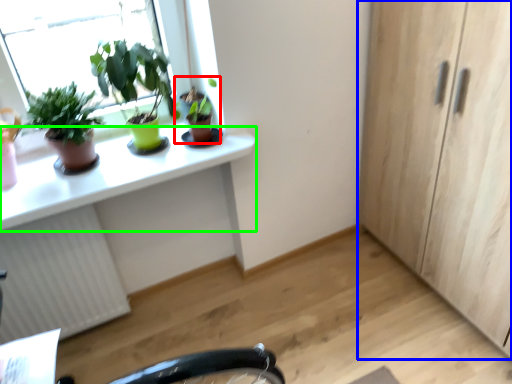
Question: Estimate the real-world distances between objects in this image. Which object is closer to houseplant (highlighted by a red box), cabinetry (highlighted by a blue box) or desk (highlighted by a green box)?

Choices:
 (A) cabinetry
 (B) desk

Answer: (B)